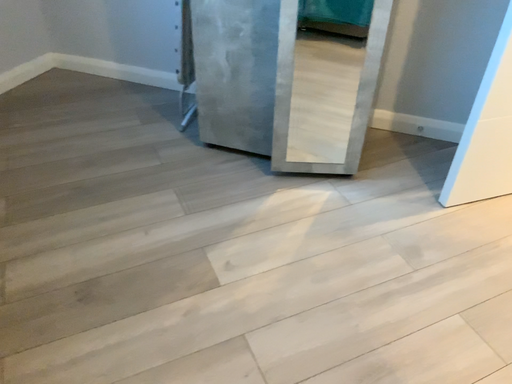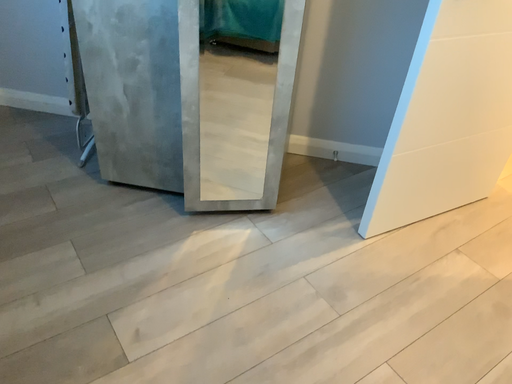
Question: How did the camera likely rotate when shooting the video?

Choices:
 (A) rotated left
 (B) rotated right

Answer: (B)